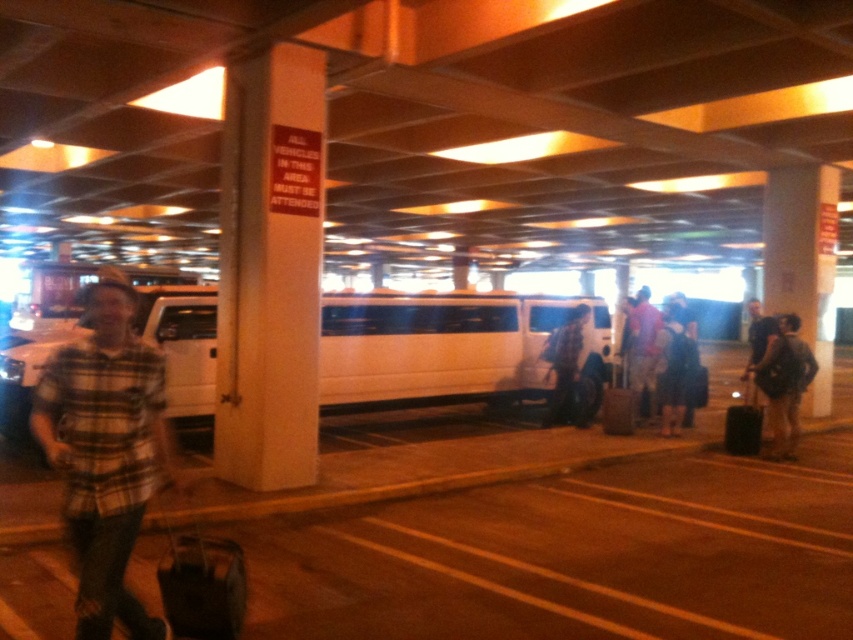
Question: Among these objects, which one is farthest from the camera?

Choices:
 (A) dark gray backpack at lower right
 (B) white matte van at center
 (C) black matte suitcase at lower right

Answer: (C)

Question: Which point is farther to the camera?

Choices:
 (A) plaid fabric shirt at left
 (B) light blue shirt at center
 (C) black matte suitcase at lower right
 (D) white matte van at center

Answer: (B)

Question: Which of the following is the farthest from the observer?

Choices:
 (A) white matte van at center
 (B) matte brown suitcase at center
 (C) dark gray backpack at lower right

Answer: (B)

Question: Does white matte van at center come behind plaid fabric shirt at left?

Choices:
 (A) yes
 (B) no

Answer: (A)

Question: Does white matte van at center have a greater width compared to black matte suitcase at lower right?

Choices:
 (A) yes
 (B) no

Answer: (B)

Question: Can you confirm if light blue shirt at center is smaller than matte brown suitcase at center?

Choices:
 (A) no
 (B) yes

Answer: (A)